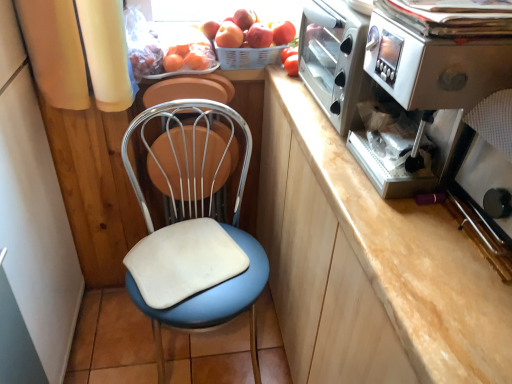
Question: Is satin silver coffee machine at right not within red matte apple at upper center, arranged as the second apple when viewed from the right?

Choices:
 (A) yes
 (B) no

Answer: (A)

Question: Is satin silver coffee machine at right bigger than red matte apple at upper center, arranged as the second apple when viewed from the right?

Choices:
 (A) no
 (B) yes

Answer: (B)

Question: Does satin silver coffee machine at right have a greater height compared to red matte apple at upper center, arranged as the 2th apple when viewed from the left?

Choices:
 (A) yes
 (B) no

Answer: (A)

Question: Considering the relative sizes of satin silver coffee machine at right and red matte apple at upper center, arranged as the 2th apple when viewed from the left, in the image provided, is satin silver coffee machine at right thinner than red matte apple at upper center, arranged as the 2th apple when viewed from the left,?

Choices:
 (A) no
 (B) yes

Answer: (A)

Question: Is satin silver coffee machine at right placed right next to red matte apple at upper center, arranged as the 2th apple when viewed from the left?

Choices:
 (A) yes
 (B) no

Answer: (B)

Question: Looking at their shapes, would you say red matte apple at upper center, the 3th apple when ordered from left to right, is wider or thinner than red matte tomato at upper right?

Choices:
 (A) wide
 (B) thin

Answer: (A)

Question: Does point (274, 44) appear closer or farther from the camera than point (289, 57)?

Choices:
 (A) closer
 (B) farther

Answer: (B)

Question: Is red matte apple at upper center, placed as the 1th apple when sorted from right to left, situated inside red matte tomato at upper right or outside?

Choices:
 (A) outside
 (B) inside

Answer: (A)

Question: From a real-world perspective, relative to red matte tomato at upper right, is red matte apple at upper center, the 3th apple when ordered from left to right, vertically above or below?

Choices:
 (A) above
 (B) below

Answer: (A)

Question: Which is correct: red matte tomato at upper right is inside smooth red apple at upper center, the 3th apple viewed from the right, or outside of it?

Choices:
 (A) inside
 (B) outside

Answer: (B)

Question: In the image, is red matte tomato at upper right positioned in front of or behind smooth red apple at upper center, which is the first apple in left-to-right order?

Choices:
 (A) front
 (B) behind

Answer: (A)

Question: From a real-world perspective, is red matte tomato at upper right positioned above or below smooth red apple at upper center, which is the first apple in left-to-right order?

Choices:
 (A) above
 (B) below

Answer: (B)

Question: Based on their positions, is red matte tomato at upper right located to the left or right of smooth red apple at upper center, which is the first apple in left-to-right order?

Choices:
 (A) right
 (B) left

Answer: (A)

Question: Looking at their shapes, would you say satin silver coffee machine at right is wider or thinner than red matte apple at upper center, arranged as the 2th apple when viewed from the left?

Choices:
 (A) thin
 (B) wide

Answer: (B)

Question: Which is correct: satin silver coffee machine at right is inside red matte apple at upper center, arranged as the second apple when viewed from the right, or outside of it?

Choices:
 (A) inside
 (B) outside

Answer: (B)